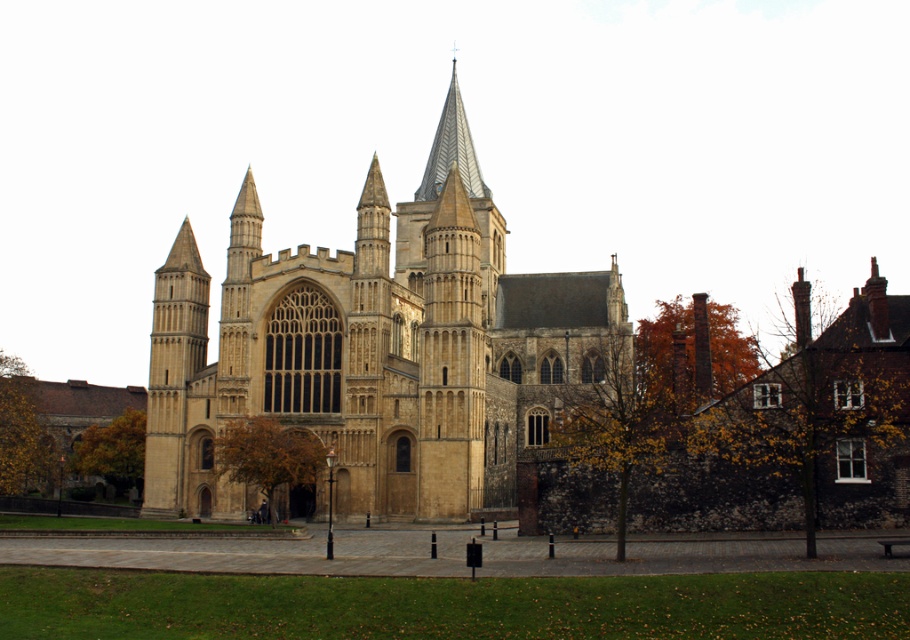
Can you confirm if yellow-green foliage at lower left is positioned to the right of golden leafy tree at lower left?

In fact, yellow-green foliage at lower left is to the left of golden leafy tree at lower left.

Can you confirm if yellow-green foliage at lower left is smaller than golden leafy tree at lower left?

No.

Which is behind, point (33, 396) or point (69, 456)?

Point (33, 396)

You are a GUI agent. You are given a task and a screenshot of the screen. Output one action in this format:
    pyautogui.click(x=<x>, y=<y>)
    Task: Click on the yellow-green foliage at lower left
    
    Given the screenshot: What is the action you would take?
    pyautogui.click(x=21, y=432)

Where is `yellow leafy tree at right`? The width and height of the screenshot is (910, 640). yellow leafy tree at right is located at coordinates (824, 408).

Is yellow leafy tree at right behind yellow-green leaves at center?

Yes, it is.

Find the location of a particular element. The image size is (910, 640). yellow leafy tree at right is located at coordinates (824, 408).

Can you confirm if yellow-green leaves at center is positioned to the left of brown leafy tree at center?

No, yellow-green leaves at center is not to the left of brown leafy tree at center.

Who is taller, yellow-green leaves at center or brown leafy tree at center?

yellow-green leaves at center

Is point (706, 360) less distant than point (219, 461)?

Yes.

Find the location of `yellow-green leaves at center`. yellow-green leaves at center is located at coordinates (627, 412).